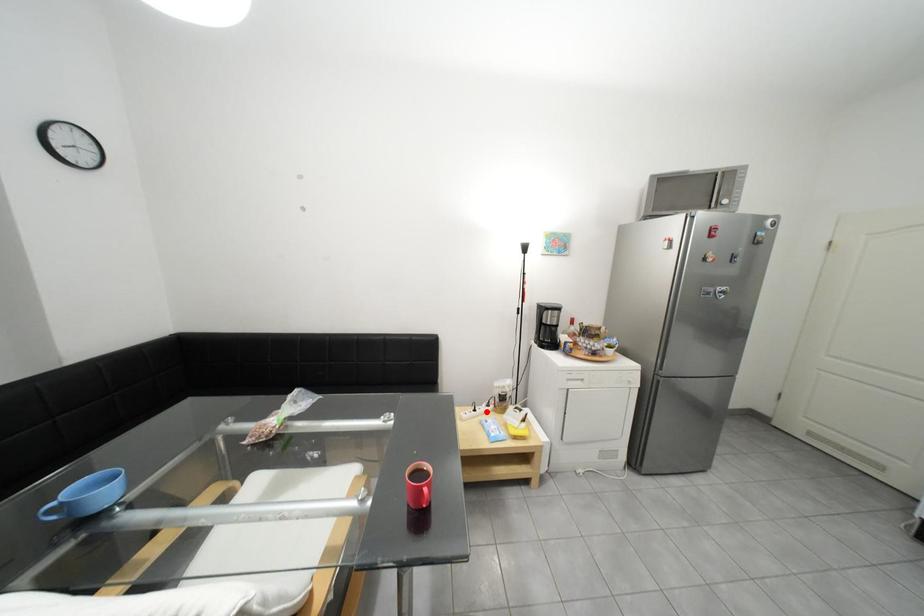
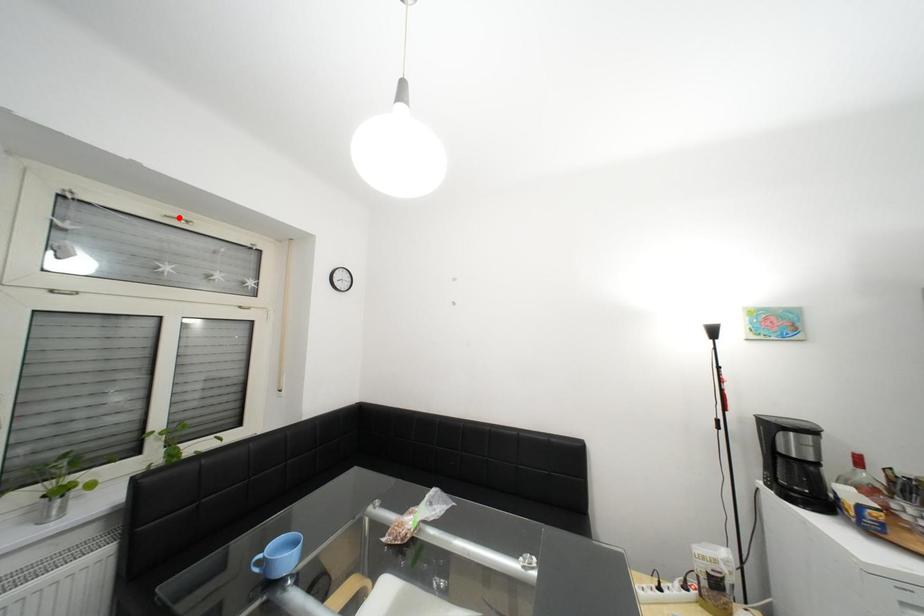
Based on the photo, I am providing you with two images of the same scene from different viewpoints. A red point is marked on the first image and another point is marked on the second image. Are the points marked in image1 and image2 representing the same 3D position?

No